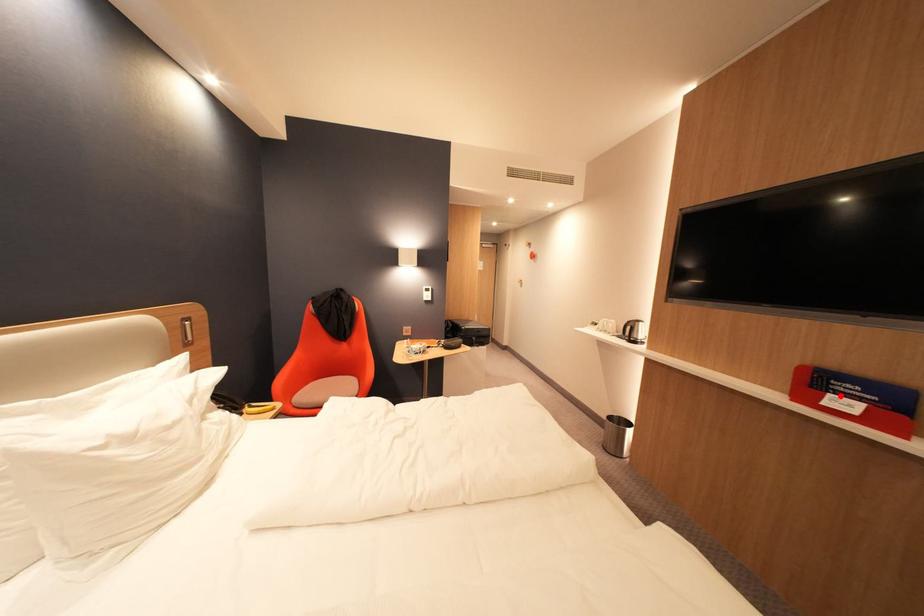
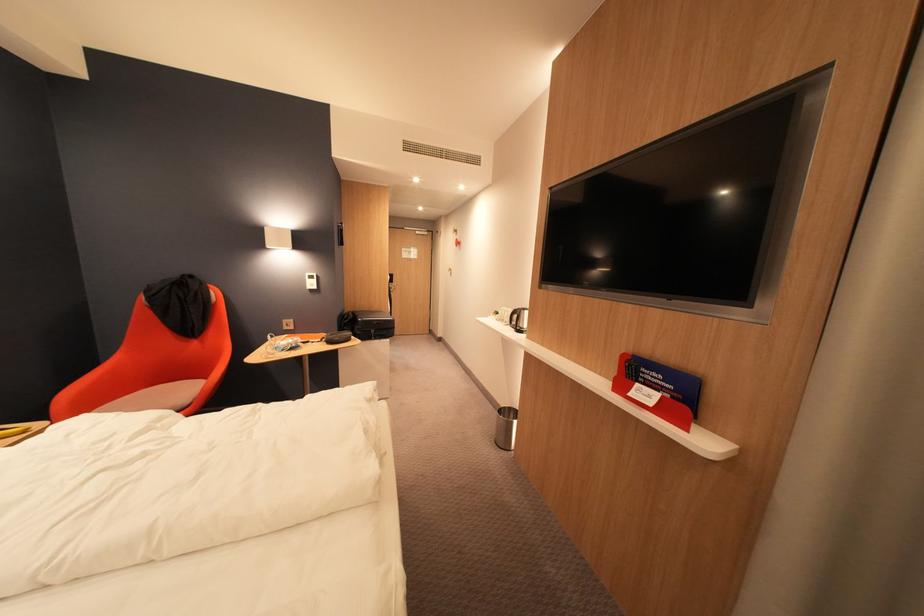
Where in the second image is the point corresponding to the highlighted location from the first image?

(648, 386)